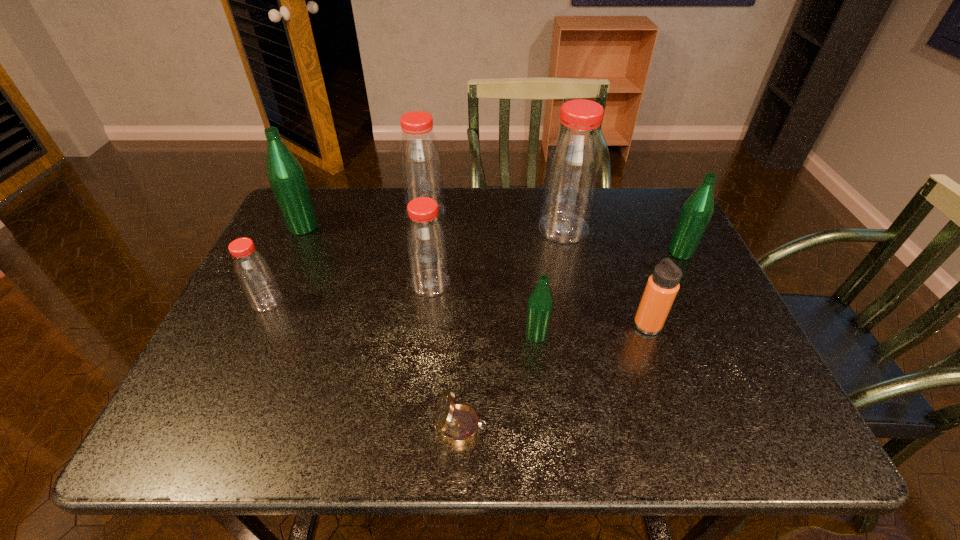
In the image, there is a desktop. Where is `vacant space at the right edge`? Image resolution: width=960 pixels, height=540 pixels. vacant space at the right edge is located at coordinates (695, 291).

Find the location of a particular element. The height and width of the screenshot is (540, 960). free point at the far left corner is located at coordinates (313, 188).

In the image, there is a desktop. Where is `free region at the near left corner`? free region at the near left corner is located at coordinates (202, 431).

Identify the location of vacant space at the far right corner of the desktop. (633, 220).

The image size is (960, 540). In the image, there is a desktop. What are the coordinates of `free space at the near right corner` in the screenshot? It's located at point(741,447).

The height and width of the screenshot is (540, 960). Identify the location of vacant region between the smallest red bottle and the nearest object. (364, 364).

This screenshot has height=540, width=960. Find the location of `unoccupied position between the smallest red bottle and the second object from right to left`. unoccupied position between the smallest red bottle and the second object from right to left is located at coordinates tap(457, 313).

You are a GUI agent. You are given a task and a screenshot of the screen. Output one action in this format:
    pyautogui.click(x=<x>, y=<y>)
    Task: Click on the free area in between the rightmost bottle and the shortest object
    Image resolution: width=960 pixels, height=540 pixels.
    Given the screenshot: What is the action you would take?
    pyautogui.click(x=571, y=339)

Find the location of `free point between the second smallest red bottle and the leftmost red bottle`. free point between the second smallest red bottle and the leftmost red bottle is located at coordinates (348, 292).

Image resolution: width=960 pixels, height=540 pixels. Identify the location of empty space that is in between the third biggest red bottle and the farthest green bottle. (367, 255).